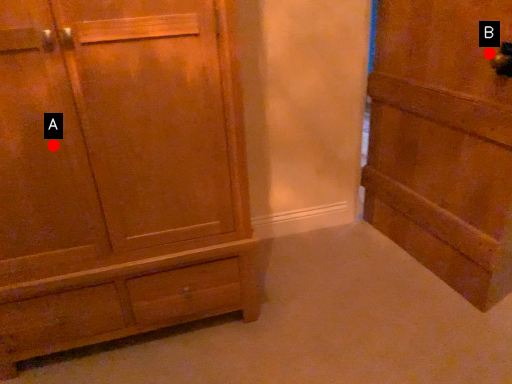
Question: Two points are circled on the image, labeled by A and B beside each circle. Which point is closer to the camera?

Choices:
 (A) A is closer
 (B) B is closer

Answer: (A)